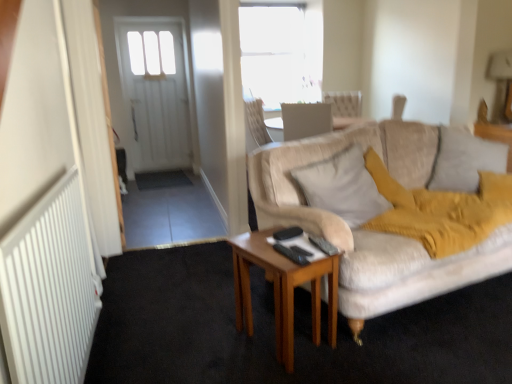
Question: Is black plastic remote control at center, which is counted as the 2th remote control, starting from the front, positioned with its back to metallic gold lampshade at upper right?

Choices:
 (A) yes
 (B) no

Answer: (B)

Question: Are black plastic remote control at center, the 2th remote control in the back-to-front sequence, and metallic gold lampshade at upper right making contact?

Choices:
 (A) no
 (B) yes

Answer: (A)

Question: From a real-world perspective, is black plastic remote control at center, which is counted as the 2th remote control, starting from the front, on metallic gold lampshade at upper right?

Choices:
 (A) yes
 (B) no

Answer: (B)

Question: Considering the relative sizes of black plastic remote control at center, which is counted as the 2th remote control, starting from the front, and metallic gold lampshade at upper right in the image provided, is black plastic remote control at center, which is counted as the 2th remote control, starting from the front, smaller than metallic gold lampshade at upper right?

Choices:
 (A) yes
 (B) no

Answer: (A)

Question: Can you confirm if black plastic remote control at center, the 2th remote control in the back-to-front sequence, is taller than metallic gold lampshade at upper right?

Choices:
 (A) no
 (B) yes

Answer: (A)

Question: Is black plastic remote control at center, which is counted as the 2th remote control, starting from the front, positioned behind metallic gold lampshade at upper right?

Choices:
 (A) yes
 (B) no

Answer: (B)

Question: From a real-world perspective, does light beige fabric pillow at center, which is the second pillow from right to left, sit lower than metallic gold lampshade at upper right?

Choices:
 (A) yes
 (B) no

Answer: (A)

Question: Is light beige fabric pillow at center, which is the second pillow from right to left, further to camera compared to metallic gold lampshade at upper right?

Choices:
 (A) yes
 (B) no

Answer: (B)

Question: From the image's perspective, is light beige fabric pillow at center, which is the second pillow from right to left, beneath metallic gold lampshade at upper right?

Choices:
 (A) yes
 (B) no

Answer: (A)

Question: From a real-world perspective, does light beige fabric pillow at center, arranged as the 1th pillow when viewed from the left, stand above metallic gold lampshade at upper right?

Choices:
 (A) no
 (B) yes

Answer: (A)

Question: Does light beige fabric pillow at center, which is the second pillow from right to left, have a greater height compared to metallic gold lampshade at upper right?

Choices:
 (A) no
 (B) yes

Answer: (A)

Question: Is light beige fabric pillow at center, which is the second pillow from right to left, oriented towards metallic gold lampshade at upper right?

Choices:
 (A) yes
 (B) no

Answer: (B)

Question: From a real-world perspective, is black plastic remote control at center, which ranks as the third remote control in front-to-back order, positioned over black plastic remote control at center, which is counted as the 2th remote control, starting from the front, based on gravity?

Choices:
 (A) no
 (B) yes

Answer: (B)